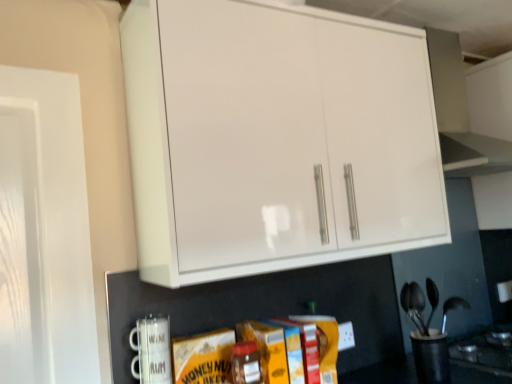
Question: From a real-world perspective, is black plastic utensil holder at lower right, which appears as the 2th appliance when viewed from the left, positioned above or below white glossy cabinet at upper center?

Choices:
 (A) below
 (B) above

Answer: (A)

Question: In the image, is black plastic utensil holder at lower right, acting as the 2th appliance starting from the top, positioned in front of or behind white glossy cabinet at upper center?

Choices:
 (A) behind
 (B) front

Answer: (A)

Question: Which object is the farthest from the white glossy cabinet at upper center?

Choices:
 (A) black plastic utensil holder at lower right, acting as the 2th appliance starting from the top
 (B) white ceramic mug at lower left, the first appliance from the front
 (C) matte glass jar at center

Answer: (A)

Question: Estimate the real-world distances between objects in this image. Which object is closer to the matte glass jar at center?

Choices:
 (A) white glossy cabinet at upper center
 (B) black plastic utensil holder at lower right, acting as the 2th appliance starting from the top
 (C) white ceramic mug at lower left, marked as the 2th appliance in a right-to-left arrangement

Answer: (C)